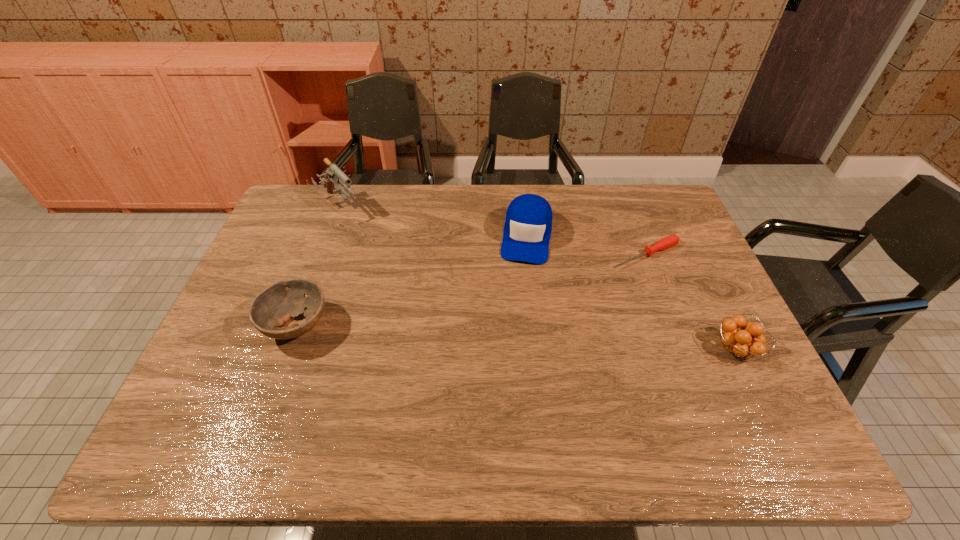
Locate an element on the screen. bowl is located at coordinates (273, 307).

Locate an element on the screen. orange fruit is located at coordinates (737, 342).

Where is `gun`? The width and height of the screenshot is (960, 540). gun is located at coordinates (333, 174).

You are a GUI agent. You are given a task and a screenshot of the screen. Output one action in this format:
    pyautogui.click(x=<x>, y=<y>)
    Task: Click on the second tallest object
    This screenshot has height=540, width=960.
    Given the screenshot: What is the action you would take?
    pyautogui.click(x=527, y=230)

Where is `the third object from left to right`? the third object from left to right is located at coordinates (527, 230).

Locate an element on the screen. This screenshot has width=960, height=540. the shortest object is located at coordinates (671, 240).

Where is `free space located on the right of the bowl`? Image resolution: width=960 pixels, height=540 pixels. free space located on the right of the bowl is located at coordinates (399, 326).

Find the location of a particular element. This screenshot has width=960, height=540. vacant position located on the back of the orange fruit is located at coordinates (685, 245).

The height and width of the screenshot is (540, 960). In order to click on vacant space located at the barrel end of the tallest object in this screenshot , I will do `click(400, 275)`.

I want to click on vacant space located 0.270m at the barrel end of the tallest object, so click(x=392, y=265).